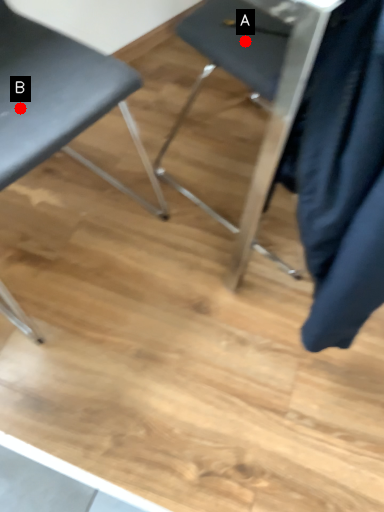
Question: Two points are circled on the image, labeled by A and B beside each circle. Which point is farther to the camera?

Choices:
 (A) A is further
 (B) B is further

Answer: (A)